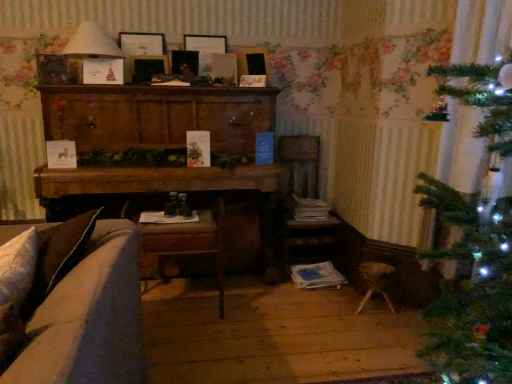
Question: Is wooden picture frame at upper center, marked as the 3th picture frame in a left-to-right arrangement, bigger or smaller than matte wooden picture frame at upper center, which is counted as the 1th picture frame, starting from the right?

Choices:
 (A) small
 (B) big

Answer: (A)

Question: From the image's perspective, relative to matte wooden picture frame at upper center, which appears as the fourth picture frame when viewed from the left, is wooden picture frame at upper center, marked as the 3th picture frame in a left-to-right arrangement, above or below?

Choices:
 (A) above
 (B) below

Answer: (A)

Question: Estimate the real-world distances between objects in this image. Which object is closer to the wooden cabinet at center?

Choices:
 (A) matte white lampshade at upper left
 (B) velvet beige couch at lower left
 (C) matte wooden picture frame at upper center, the 4th picture frame in the right-to-left sequence
 (D) wooden armchair at center
 (E) wooden picture frame at center, marked as the second picture frame in a left-to-right arrangement

Answer: (A)

Question: Estimate the real-world distances between objects in this image. Which object is farther from the wooden picture frame at upper center, the second picture frame in the right-to-left sequence?

Choices:
 (A) wooden picture frame at center, marked as the second picture frame in a left-to-right arrangement
 (B) matte wooden picture frame at upper center, which is counted as the 1th picture frame, starting from the right
 (C) wooden armchair at center
 (D) woodenchair at lower center
 (E) matte white lampshade at upper left

Answer: (D)